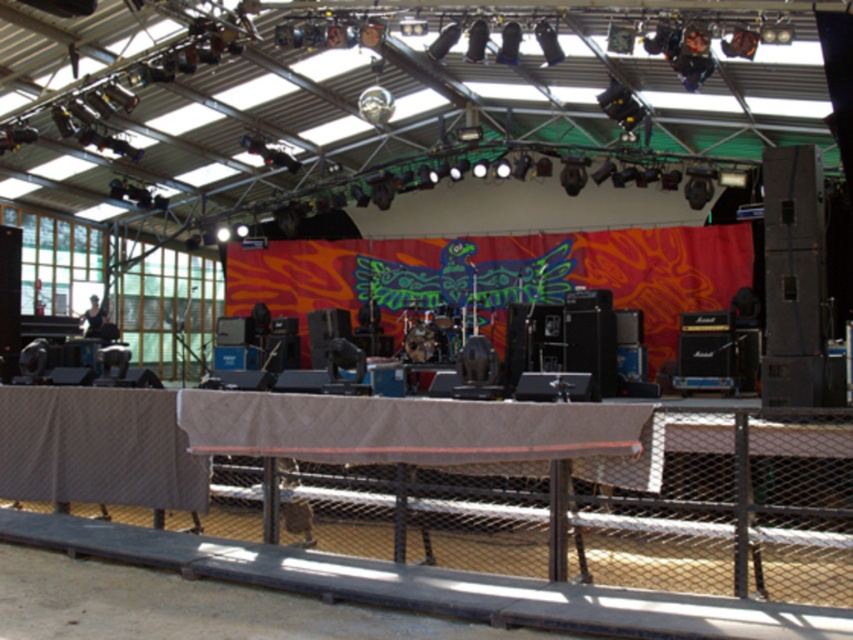
Question: Does beige fabric-covered table at center appear over brown textured table at lower left?

Choices:
 (A) yes
 (B) no

Answer: (A)

Question: Which point appears farthest from the camera in this image?

Choices:
 (A) (128, 420)
 (B) (213, 422)

Answer: (A)

Question: Is beige fabric-covered table at center to the left of brown textured table at lower left from the viewer's perspective?

Choices:
 (A) no
 (B) yes

Answer: (A)

Question: Observing the image, what is the correct spatial positioning of beige fabric-covered table at center in reference to brown textured table at lower left?

Choices:
 (A) above
 (B) below

Answer: (A)